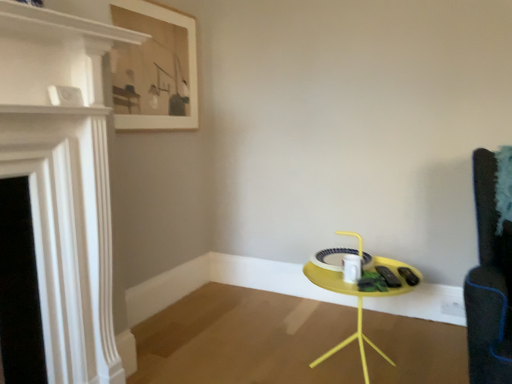
Question: Does white glossy fireplace at left lie in front of wooden framed artwork at upper left?

Choices:
 (A) no
 (B) yes

Answer: (B)

Question: From a real-world perspective, is white glossy fireplace at left on wooden framed artwork at upper left?

Choices:
 (A) yes
 (B) no

Answer: (B)

Question: Can you confirm if white glossy fireplace at left is positioned to the left of wooden framed artwork at upper left?

Choices:
 (A) no
 (B) yes

Answer: (B)

Question: Is white glossy fireplace at left bigger than wooden framed artwork at upper left?

Choices:
 (A) yes
 (B) no

Answer: (A)

Question: From the image's perspective, is white glossy fireplace at left above wooden framed artwork at upper left?

Choices:
 (A) no
 (B) yes

Answer: (A)

Question: Is white glossy fireplace at left taller than wooden framed artwork at upper left?

Choices:
 (A) yes
 (B) no

Answer: (A)

Question: Is white glossy fireplace at left closer to camera compared to yellow matte table at center?

Choices:
 (A) no
 (B) yes

Answer: (B)

Question: Are white glossy fireplace at left and yellow matte table at center far apart?

Choices:
 (A) no
 (B) yes

Answer: (B)

Question: Considering the relative sizes of white glossy fireplace at left and yellow matte table at center in the image provided, is white glossy fireplace at left wider than yellow matte table at center?

Choices:
 (A) yes
 (B) no

Answer: (B)

Question: Is white glossy fireplace at left at the right side of yellow matte table at center?

Choices:
 (A) yes
 (B) no

Answer: (B)

Question: Considering the relative sizes of white glossy fireplace at left and yellow matte table at center in the image provided, is white glossy fireplace at left bigger than yellow matte table at center?

Choices:
 (A) yes
 (B) no

Answer: (B)

Question: Does white glossy fireplace at left turn towards yellow matte table at center?

Choices:
 (A) no
 (B) yes

Answer: (A)

Question: Is wooden framed artwork at upper left not inside white glossy fireplace at left?

Choices:
 (A) no
 (B) yes

Answer: (B)